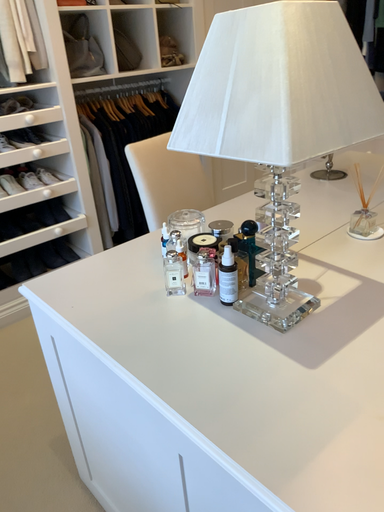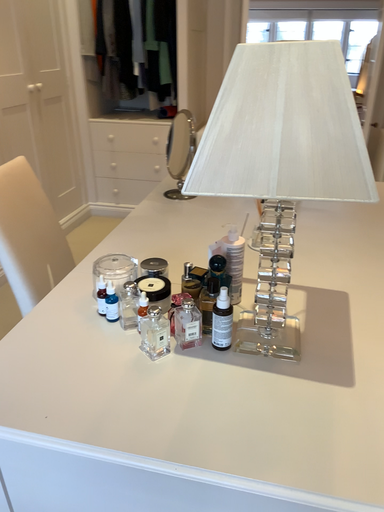
Question: Which way did the camera rotate in the video?

Choices:
 (A) rotated right
 (B) rotated left

Answer: (A)